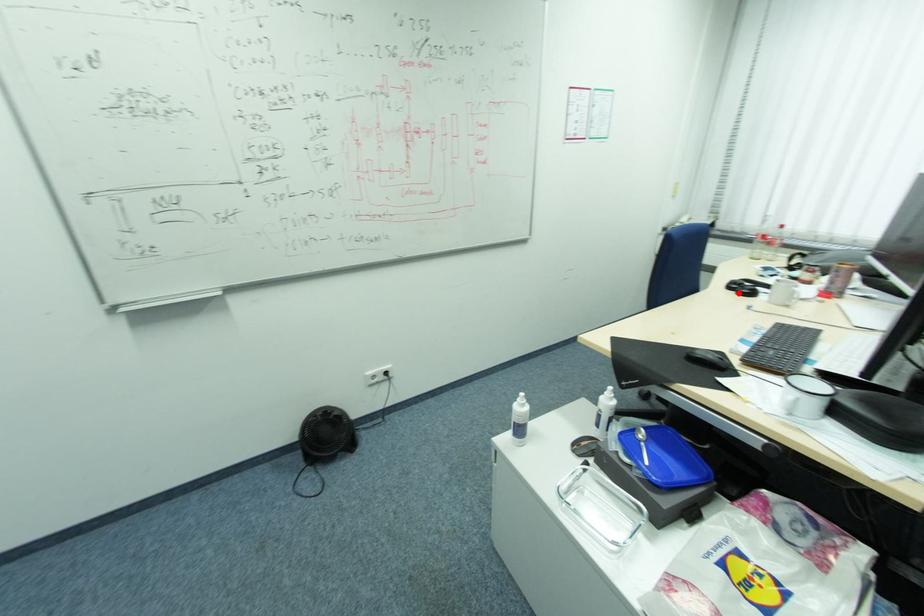
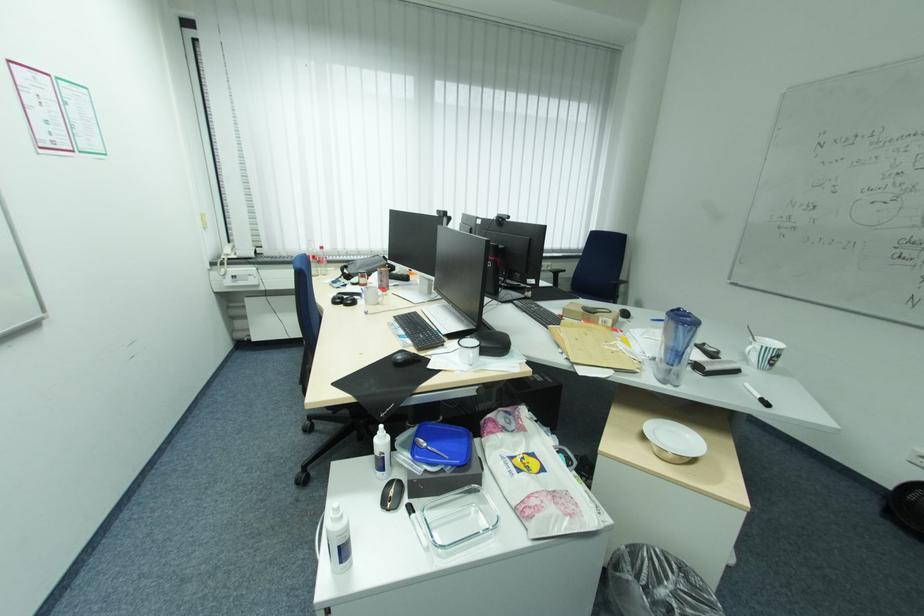
In the second image, find the point that corresponds to the highlighted location in the first image.

(348, 305)